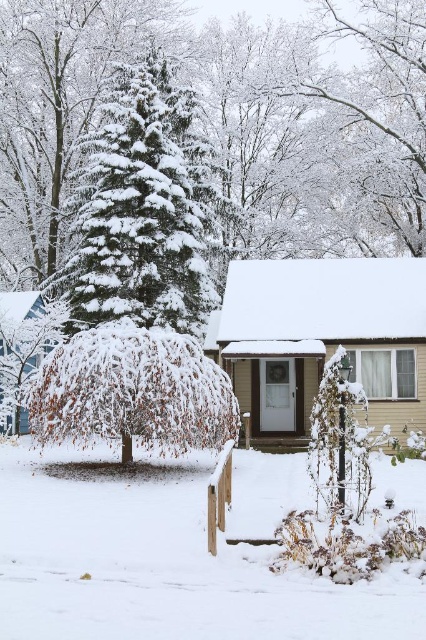
Can you confirm if white frosty branches at upper center is positioned to the left of snow-covered weeping willow at center?

No, white frosty branches at upper center is not to the left of snow-covered weeping willow at center.

Does white frosty branches at upper center appear on the right side of snow-covered weeping willow at center?

Indeed, white frosty branches at upper center is positioned on the right side of snow-covered weeping willow at center.

In order to click on white frosty branches at upper center in this screenshot , I will do `click(374, 115)`.

Locate an element on the screen. The width and height of the screenshot is (426, 640). white frosty branches at upper center is located at coordinates (374, 115).

Can you confirm if white fluffy snow at lower center is smaller than white frosty branches at upper center?

Yes, white fluffy snow at lower center is smaller than white frosty branches at upper center.

Which is behind, point (120, 548) or point (409, 93)?

The point (409, 93) is more distant.

What do you see at coordinates (164, 566) in the screenshot? The width and height of the screenshot is (426, 640). I see `white fluffy snow at lower center` at bounding box center [164, 566].

Locate an element on the screen. white fluffy snow at lower center is located at coordinates (164, 566).

Does green textured pine at center lie in front of snow-covered weeping willow at center?

No, it is behind snow-covered weeping willow at center.

This screenshot has width=426, height=640. What are the coordinates of `green textured pine at center` in the screenshot? It's located at (143, 211).